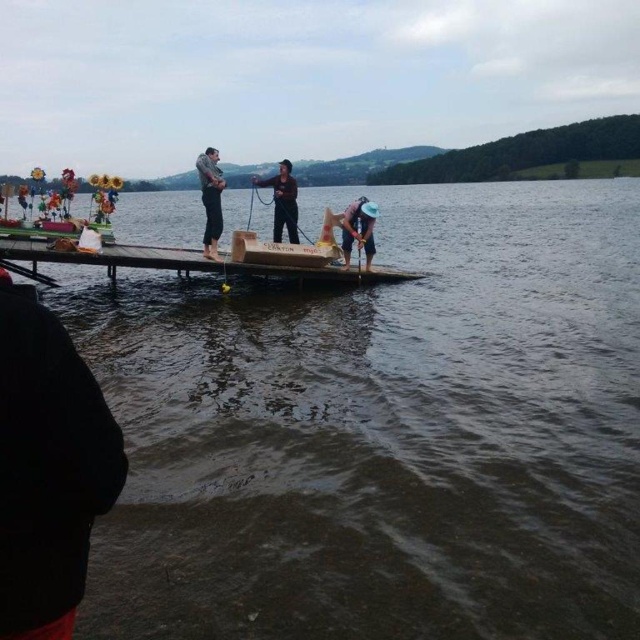
Question: Which point is farther from the camera taking this photo?

Choices:
 (A) (317, 260)
 (B) (212, 211)
 (C) (353, 205)

Answer: (C)

Question: Which point is farther from the camera taking this photo?

Choices:
 (A) (426, 257)
 (B) (353, 227)
 (C) (212, 193)
 (D) (36, 246)

Answer: (A)

Question: Is gray flannel shirt at center bigger than blue fabric hat at lower right?

Choices:
 (A) yes
 (B) no

Answer: (A)

Question: Is black matte shirt at center bigger than blue fabric hat at lower right?

Choices:
 (A) yes
 (B) no

Answer: (A)

Question: Among these points, which one is farthest from the camera?

Choices:
 (A) (358, 236)
 (B) (276, 218)
 (C) (221, 227)

Answer: (B)

Question: Does gray flannel shirt at center lie in front of blue fabric hat at lower right?

Choices:
 (A) yes
 (B) no

Answer: (A)